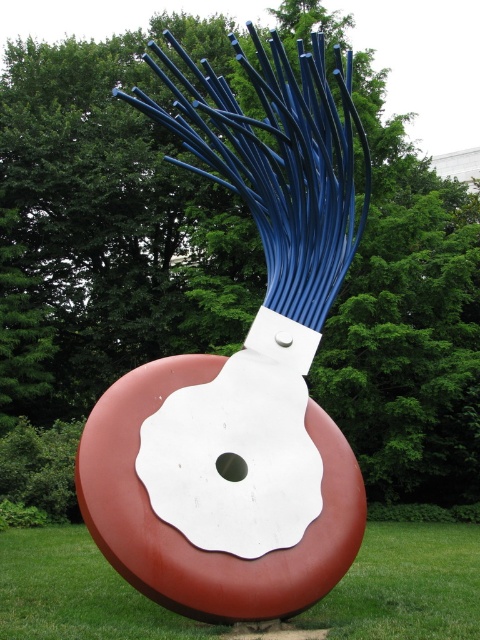
What are the coordinates of the matte blue wire at center?

The matte blue wire at center is located at coordinates point (242, 372).